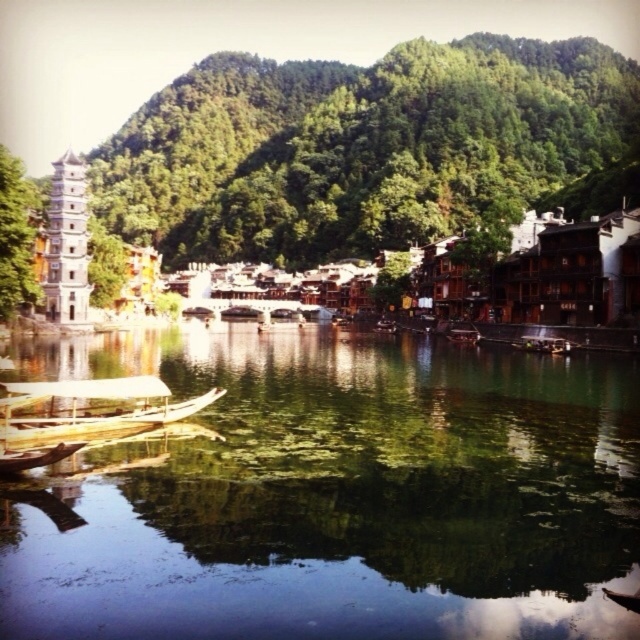
Question: Is the position of green reflective water at center less distant than that of wooden boat at lower left?

Choices:
 (A) no
 (B) yes

Answer: (B)

Question: In this image, where is green leafy hillside at upper center located relative to white stone tower at left?

Choices:
 (A) above
 (B) below

Answer: (A)

Question: Among these objects, which one is nearest to the camera?

Choices:
 (A) wooden boat at center
 (B) wooden boat at lower left
 (C) green reflective water at center
 (D) white stone tower at left

Answer: (C)

Question: Among these objects, which one is nearest to the camera?

Choices:
 (A) wooden boat at lower left
 (B) green leafy hillside at upper center

Answer: (A)

Question: Can you confirm if green reflective water at center is smaller than green leafy hillside at upper center?

Choices:
 (A) yes
 (B) no

Answer: (A)

Question: Estimate the real-world distances between objects in this image. Which object is closer to the wooden boat at center?

Choices:
 (A) white stone tower at left
 (B) wooden boat at lower left
 (C) green leafy hillside at upper center

Answer: (A)